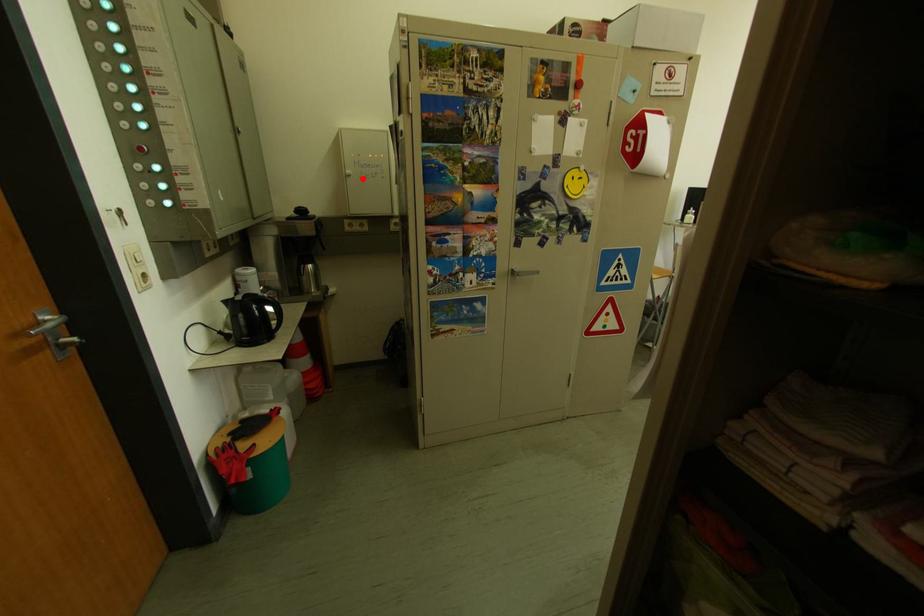
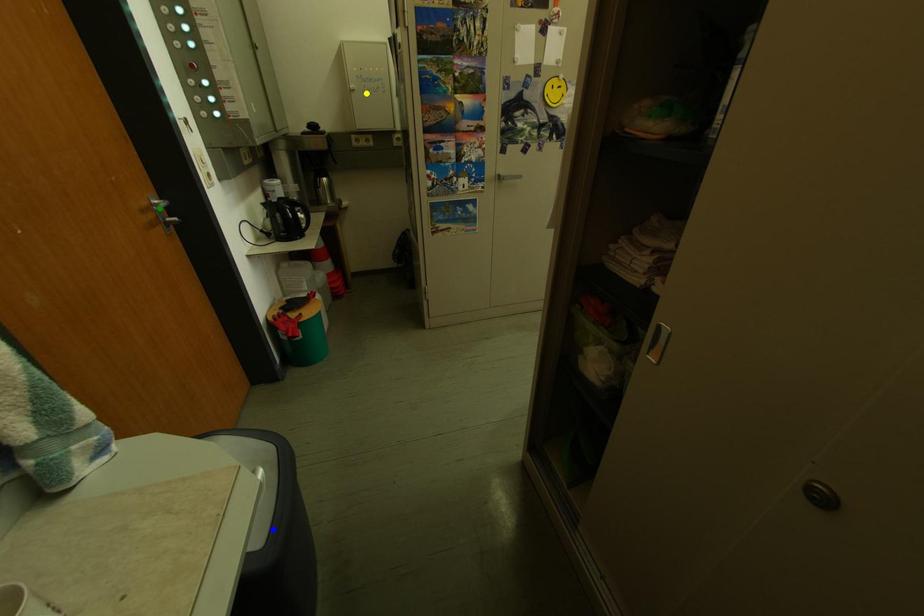
Question: I am providing you with two images of the same scene from different viewpoints. A red point is marked on the first image. You are given multiple points on the second image. Which point in image 2 is actually the same real-world point as the red point in image 1?

Choices:
 (A) green point
 (B) blue point
 (C) yellow point

Answer: (C)